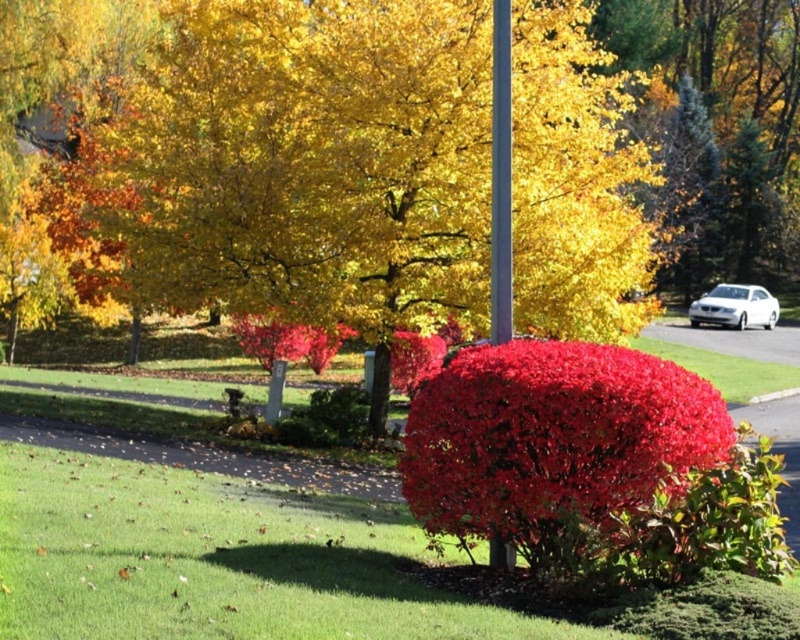
Looking at this image, does shiny red bush at center appear on the right side of metallic silver pole at center?

Yes, shiny red bush at center is to the right of metallic silver pole at center.

Who is more distant from viewer, (600, 522) or (496, 257)?

Point (496, 257)

Does point (474, 456) lie in front of point (494, 170)?

Yes, it is in front of point (494, 170).

The width and height of the screenshot is (800, 640). I want to click on shiny red bush at center, so [x=552, y=442].

Is metallic silver pole at center shorter than white glossy sedan at right?

Yes, metallic silver pole at center is shorter than white glossy sedan at right.

Between point (490, 339) and point (748, 307), which one is positioned in front?

Point (490, 339) is more forward.

The width and height of the screenshot is (800, 640). What are the coordinates of `metallic silver pole at center` in the screenshot? It's located at (501, 177).

Who is positioned more to the left, shiny red bush at center or white glossy sedan at right?

From the viewer's perspective, shiny red bush at center appears more on the left side.

Is the position of shiny red bush at center less distant than that of white glossy sedan at right?

Yes, shiny red bush at center is closer to the viewer.

Is point (442, 472) positioned before point (776, 310)?

That is True.

You are a GUI agent. You are given a task and a screenshot of the screen. Output one action in this format:
    pyautogui.click(x=<x>, y=<y>)
    Task: Click on the shiny red bush at center
    This screenshot has height=640, width=800.
    Given the screenshot: What is the action you would take?
    pyautogui.click(x=552, y=442)